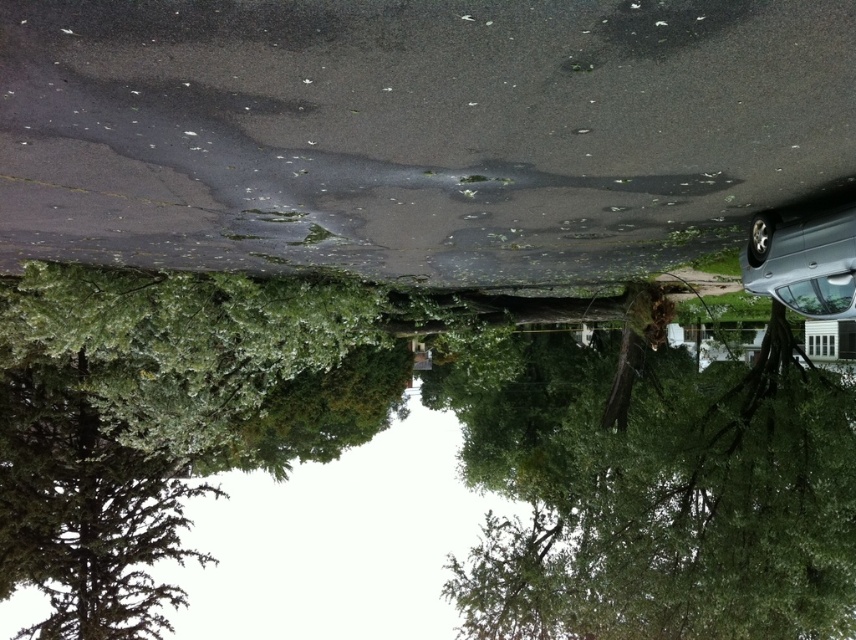
Question: Which object appears farthest from the camera in this image?

Choices:
 (A) silver metallic car at right
 (B) green leafy tree at left

Answer: (B)

Question: Is green leafy tree at center below silver metallic car at right?

Choices:
 (A) no
 (B) yes

Answer: (B)

Question: Which point is farther from the camera taking this photo?

Choices:
 (A) (580, 392)
 (B) (829, 228)
 (C) (227, 436)

Answer: (A)

Question: Does green leafy tree at center appear over green leafy tree at left?

Choices:
 (A) yes
 (B) no

Answer: (B)

Question: Does green leafy tree at center lie behind silver metallic car at right?

Choices:
 (A) no
 (B) yes

Answer: (B)

Question: Which object appears closest to the camera in this image?

Choices:
 (A) green leafy tree at left
 (B) silver metallic car at right
 (C) green leafy tree at center

Answer: (B)